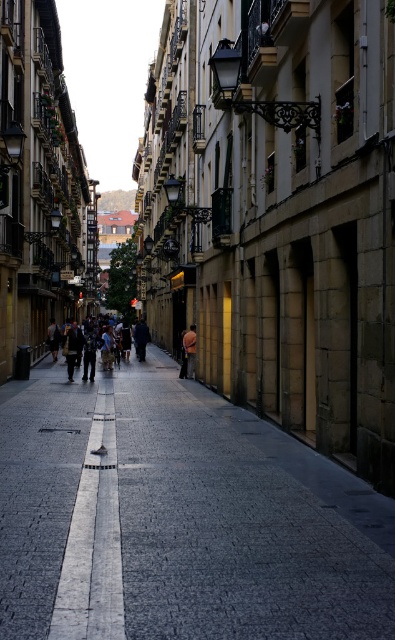
You are a tourist standing on the dark blue jeans at center in the cobblestone street. You want to walk to the dark gray cobblestone at center. How many steps would you need to take if each step covers 2.5 feet?

The dark gray cobblestone at center is 41.73 feet away from the dark blue jeans at center. Dividing the distance by the step length of 2.5 feet gives approximately 16.69 steps. Since you can only take whole steps, you would need to take 17 steps to reach the dark gray cobblestone at center.

You are a delivery person carrying an orange fabric bag at center. You need to place it on the ground in the narrow cobblestone street. Where should you put it so that it stays on the dark gray cobblestone at center?

You should place the orange fabric bag at center directly on top of the dark gray cobblestone at center since the dark gray cobblestone at center is located below it.